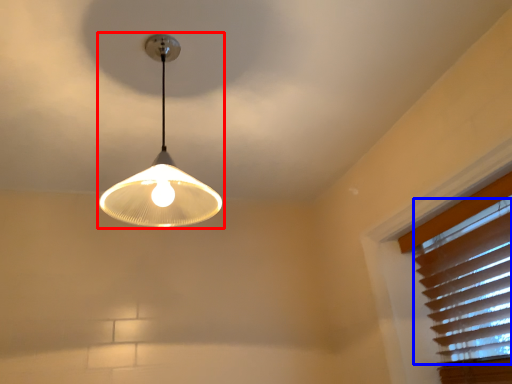
Question: Which of the following is the closest to the observer, lamp (highlighted by a red box) or blind (highlighted by a blue box)?

Choices:
 (A) lamp
 (B) blind

Answer: (A)